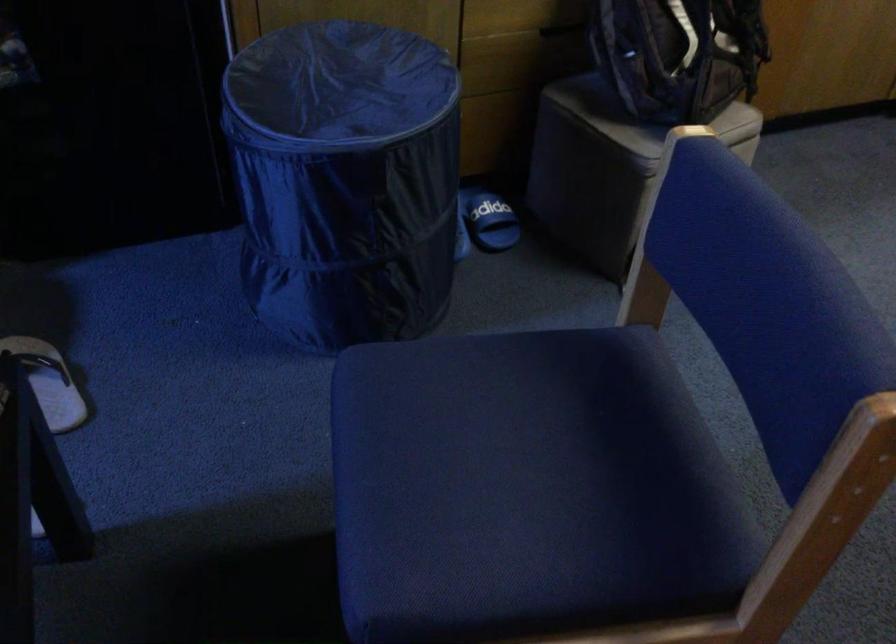
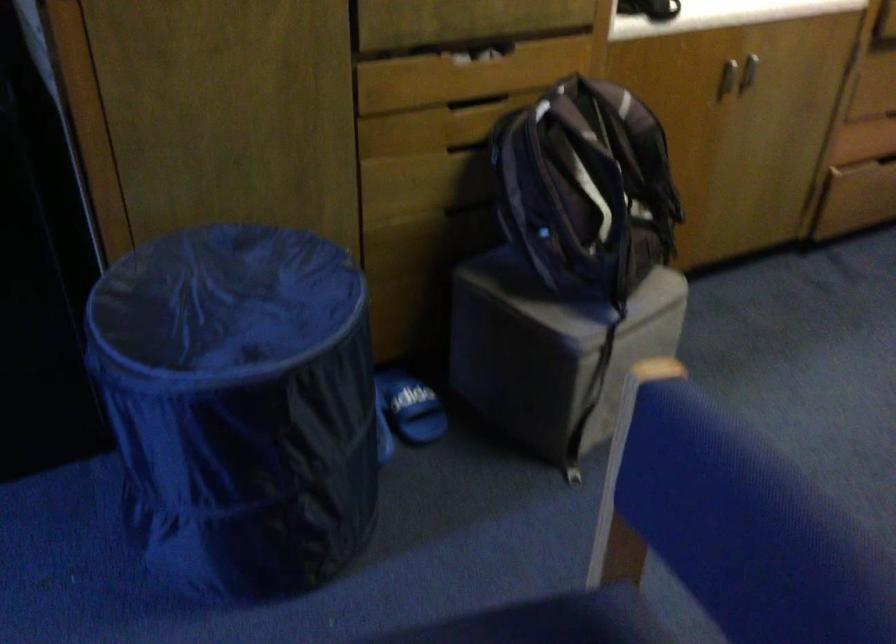
Where in the second image is the point corresponding to [487,214] from the first image?

(410, 406)